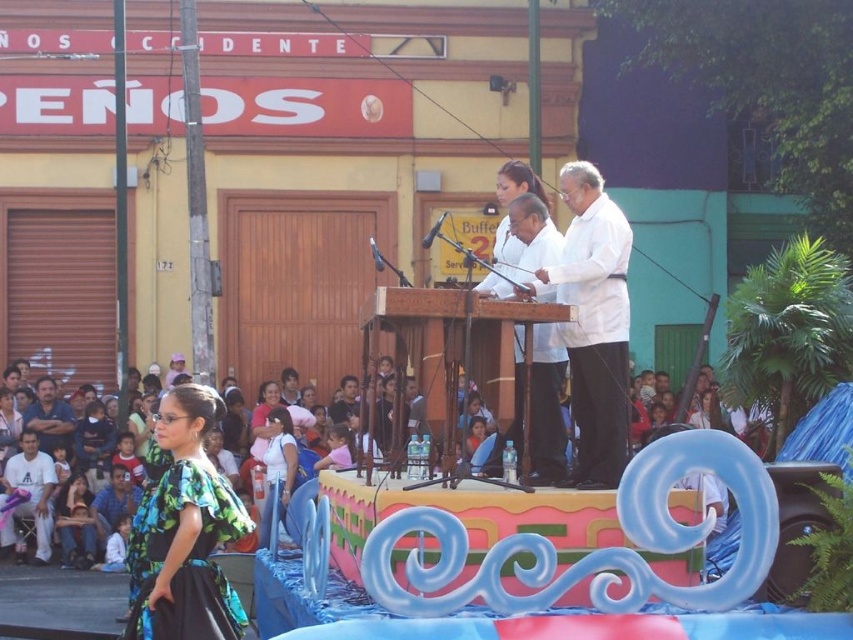
You are a photographer at the event and need to capture a photo of both the matte white blouse at center and the white cotton shirt at center. Based on their positions, which one is higher up in the frame?

The matte white blouse at center is above the white cotton shirt at center, so it is higher up in the frame.

Looking at this image, you are an event organizer who needs to arrange additional seating for guests. You have a new chair that is exactly the same size as the white fabric chair at lower left. Can you place this new chair next to the white matte coat at center without overlapping?

The white matte coat at center is wider than the white fabric chair at lower left. Since the new chair is the same size as the existing white fabric chair at lower left, there should be enough space to place it next to the white matte coat at center without overlapping, provided the area is sufficient to accommodate the combined width of both items.

You are a photographer at the event and want to capture a photo of both the matte white blouse at center and the white cotton shirt at center. Which clothing item has a narrower silhouette?

The matte white blouse at center has a narrower silhouette than the white cotton shirt at center.